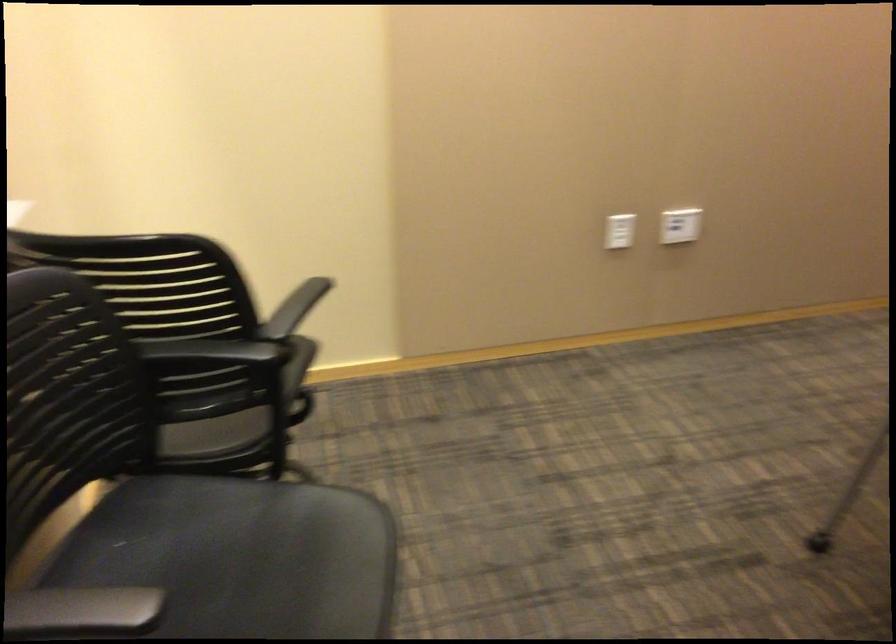
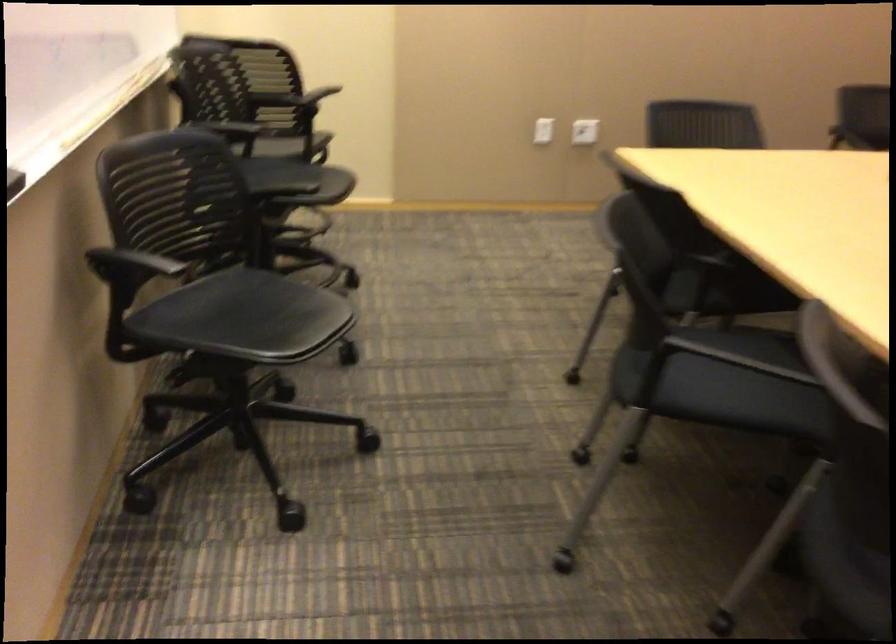
Question: In a continuous first-person perspective shot, in which direction is the camera moving?

Choices:
 (A) Left
 (B) Right
 (C) Forward
 (D) Backward

Answer: (D)